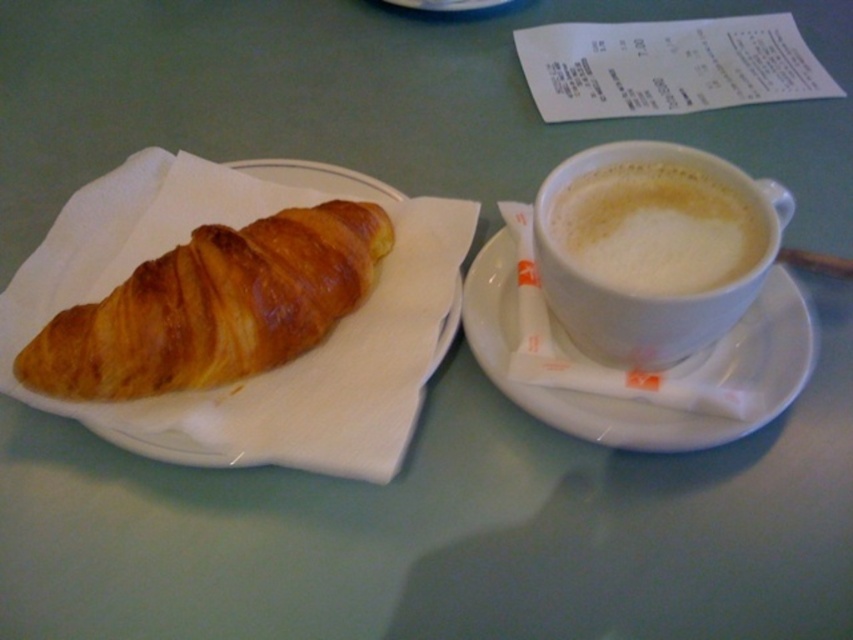
You are setting up a breakfast tray and need to place the golden brown flaky croissant at left and the white ceramic saucer at right. According to the image, which item is placed higher up?

The golden brown flaky croissant at left is positioned over the white ceramic saucer at right, so it is placed higher up.